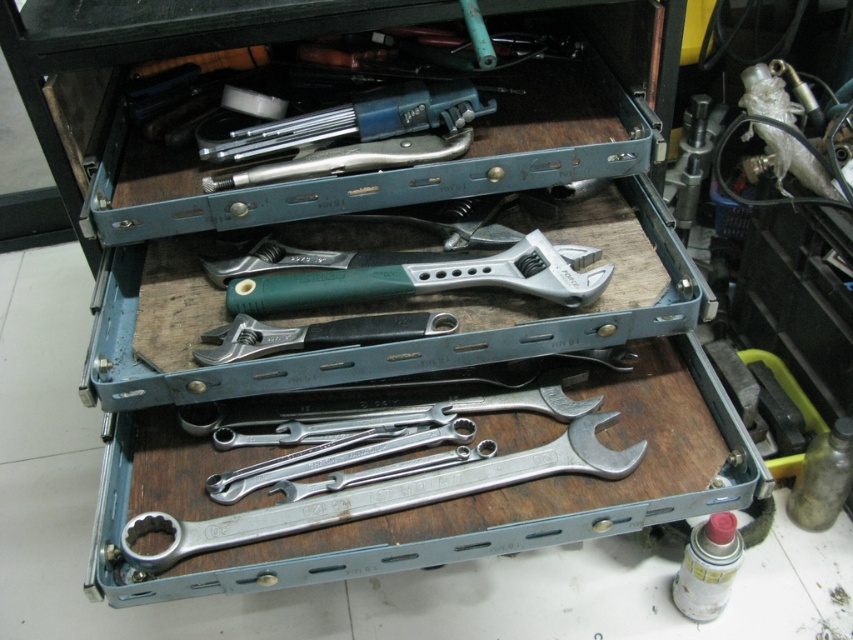
Which of these two, blue plastic drill bit at upper center or metallic silver wrench at center, stands taller?

blue plastic drill bit at upper center

Can you confirm if blue plastic drill bit at upper center is shorter than metallic silver wrench at center?

No, blue plastic drill bit at upper center is not shorter than metallic silver wrench at center.

Is point (280, 147) positioned before point (223, 180)?

No, (280, 147) is further to viewer.

Locate an element on the screen. The image size is (853, 640). blue plastic drill bit at upper center is located at coordinates (345, 122).

Image resolution: width=853 pixels, height=640 pixels. What do you see at coordinates (317, 333) in the screenshot?
I see `black rubberized wrench at center` at bounding box center [317, 333].

Does point (373, 323) come farther from viewer compared to point (292, 460)?

No.

I want to click on black rubberized wrench at center, so click(x=317, y=333).

Does silver metallic wrench at center appear on the left side of black rubberized wrench at center?

Incorrect, silver metallic wrench at center is not on the left side of black rubberized wrench at center.

Is point (469, 484) farther from viewer compared to point (367, 337)?

No, (469, 484) is in front of (367, 337).

Who is more forward, (134,554) or (369,328)?

Point (134,554) is more forward.

Image resolution: width=853 pixels, height=640 pixels. What are the coordinates of `silver metallic wrench at center` in the screenshot? It's located at coord(386,496).